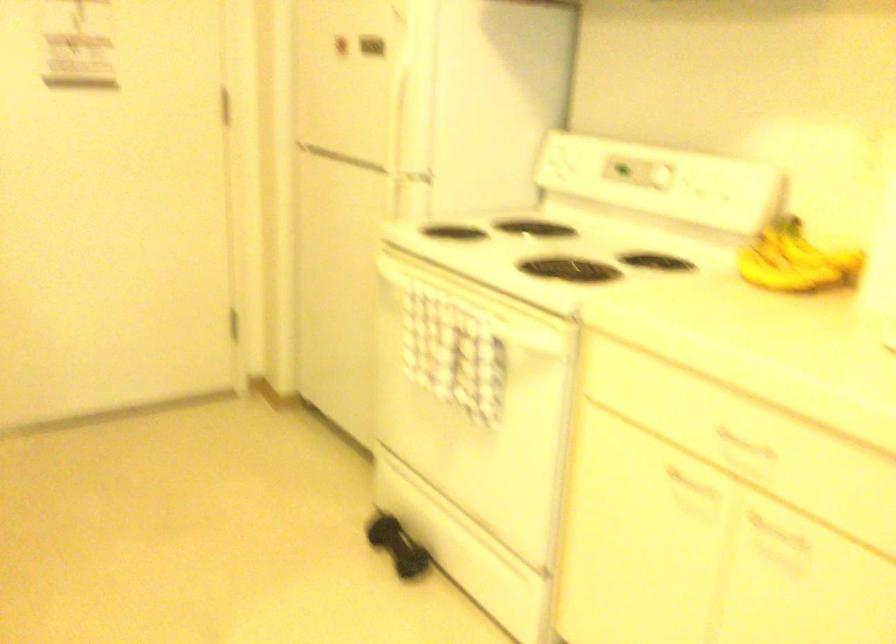
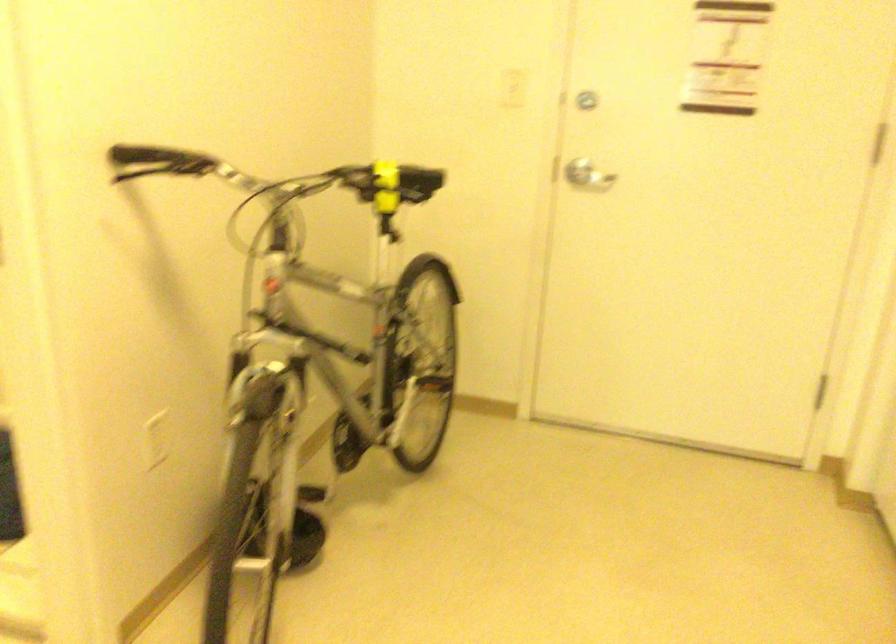
Question: The camera is either moving clockwise (left) or counter-clockwise (right) around the object. The first image is from the beginning of the video and the second image is from the end. Is the camera moving left or right when shooting the video?

Choices:
 (A) Left
 (B) Right

Answer: (B)